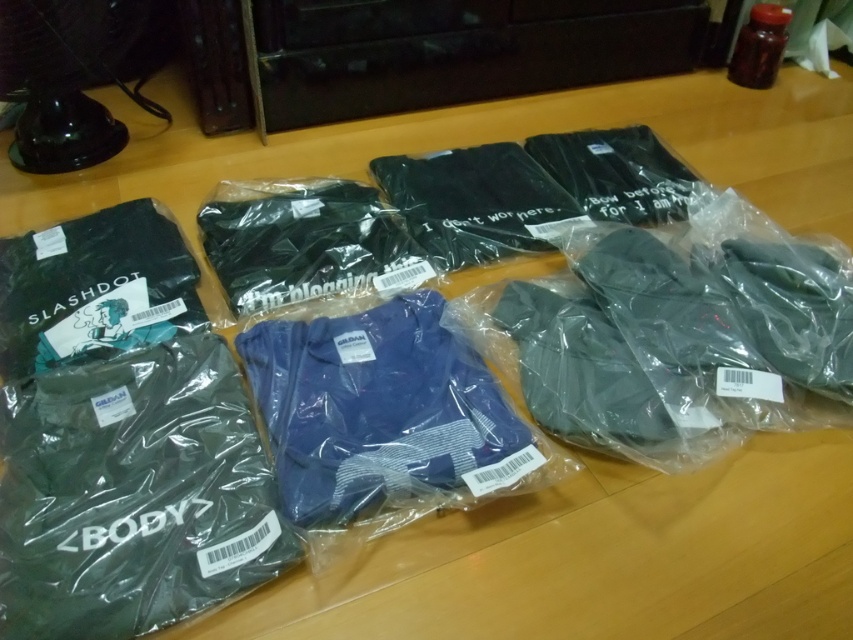
Question: Which point is closer to the camera taking this photo?

Choices:
 (A) (300, 493)
 (B) (53, 541)

Answer: (B)

Question: Is matte black t-shirt at lower left thinner than blue jersey at center?

Choices:
 (A) no
 (B) yes

Answer: (A)

Question: Which of the following is the farthest from the observer?

Choices:
 (A) blue jersey at center
 (B) matte black t-shirt at lower left

Answer: (A)

Question: Observing the image, what is the correct spatial positioning of matte black t-shirt at lower left in reference to blue jersey at center?

Choices:
 (A) right
 (B) left

Answer: (B)

Question: Where is matte black t-shirt at lower left located in relation to blue jersey at center in the image?

Choices:
 (A) left
 (B) right

Answer: (A)